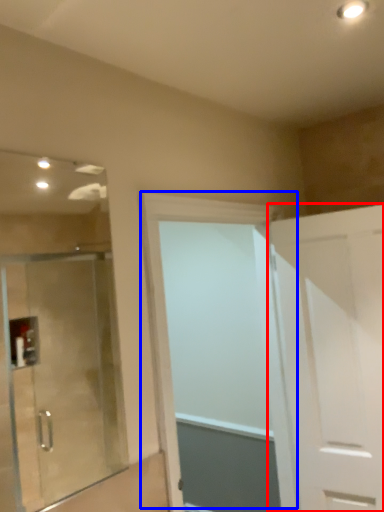
Question: Which of the following is the farthest to the observer, door (highlighted by a red box) or door (highlighted by a blue box)?

Choices:
 (A) door
 (B) door

Answer: (A)